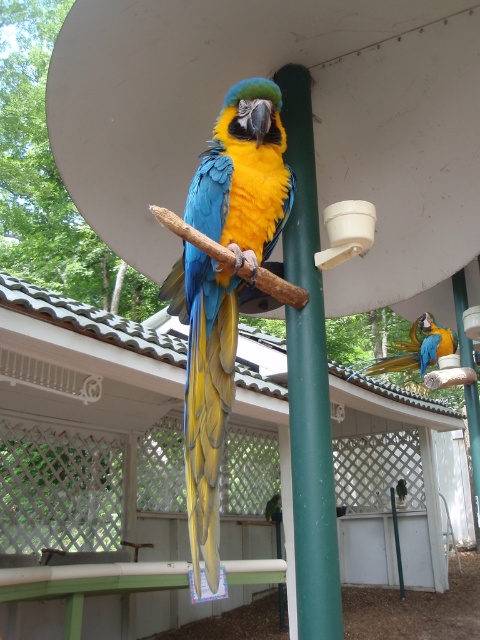
You are a birdkeeper in the aviary and need to place a new perch between the green matte pole at center and the blue glossy parrot at center. Based on their positions, which side of the parrot should the new perch be placed on?

The green matte pole at center is to the left of the blue glossy parrot at center, so the new perch should be placed to the left side of the blue glossy parrot at center.